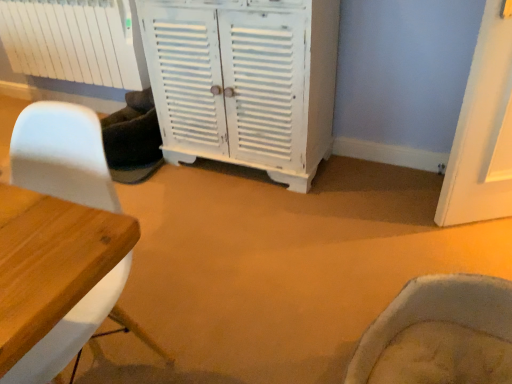
Question: Is white painted wood cabinet at center inside white matte chair at left?

Choices:
 (A) no
 (B) yes

Answer: (A)

Question: Is white matte chair at left oriented away from white painted wood cabinet at center?

Choices:
 (A) no
 (B) yes

Answer: (B)

Question: From the image's perspective, would you say white matte chair at left is positioned over white painted wood cabinet at center?

Choices:
 (A) no
 (B) yes

Answer: (A)

Question: Can you confirm if white matte chair at left is thinner than white painted wood cabinet at center?

Choices:
 (A) no
 (B) yes

Answer: (A)

Question: Can you confirm if white matte chair at left is smaller than white painted wood cabinet at center?

Choices:
 (A) no
 (B) yes

Answer: (B)

Question: Considering the positions of point (308, 173) and point (2, 3), is point (308, 173) closer or farther from the camera than point (2, 3)?

Choices:
 (A) farther
 (B) closer

Answer: (B)

Question: Based on their positions, is white painted wood cabinet at center located to the left or right of white matte radiator at upper left?

Choices:
 (A) left
 (B) right

Answer: (B)

Question: In the image, is white painted wood cabinet at center positioned in front of or behind white matte radiator at upper left?

Choices:
 (A) front
 (B) behind

Answer: (A)

Question: From the image's perspective, is white painted wood cabinet at center positioned above or below white matte radiator at upper left?

Choices:
 (A) below
 (B) above

Answer: (A)

Question: Which is correct: white painted wood cabinet at center is inside white matte chair at left, or outside of it?

Choices:
 (A) outside
 (B) inside

Answer: (A)

Question: Considering the relative positions of white painted wood cabinet at center and white matte chair at left in the image provided, is white painted wood cabinet at center to the left or to the right of white matte chair at left?

Choices:
 (A) right
 (B) left

Answer: (A)

Question: Considering the positions of point (323, 153) and point (16, 127), is point (323, 153) closer or farther from the camera than point (16, 127)?

Choices:
 (A) closer
 (B) farther

Answer: (B)

Question: From the image's perspective, is white painted wood cabinet at center located above or below white matte chair at left?

Choices:
 (A) below
 (B) above

Answer: (B)

Question: Visually, is white matte radiator at upper left positioned to the left or to the right of white painted wood cabinet at center?

Choices:
 (A) left
 (B) right

Answer: (A)

Question: Is white matte radiator at upper left taller or shorter than white painted wood cabinet at center?

Choices:
 (A) short
 (B) tall

Answer: (A)